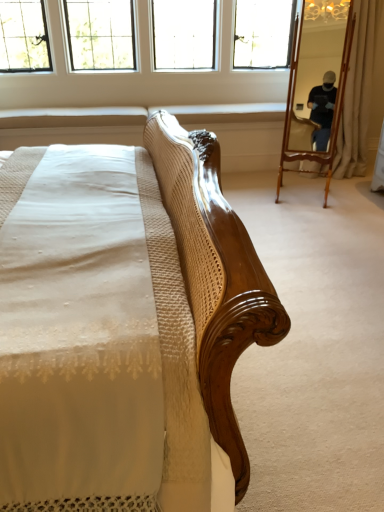
Question: Does clear glass windows at upper center contain beige fabric curtain at right?

Choices:
 (A) no
 (B) yes

Answer: (A)

Question: Considering the relative sizes of clear glass windows at upper center and beige fabric curtain at right in the image provided, is clear glass windows at upper center thinner than beige fabric curtain at right?

Choices:
 (A) yes
 (B) no

Answer: (B)

Question: Is clear glass windows at upper center in front of beige fabric curtain at right?

Choices:
 (A) no
 (B) yes

Answer: (B)

Question: Is clear glass windows at upper center far away from beige fabric curtain at right?

Choices:
 (A) yes
 (B) no

Answer: (A)

Question: Can you confirm if clear glass windows at upper center is positioned to the left of beige fabric curtain at right?

Choices:
 (A) yes
 (B) no

Answer: (A)

Question: Visually, is beige fabric curtain at right positioned to the left or to the right of wooden mirror at right?

Choices:
 (A) left
 (B) right

Answer: (B)

Question: Based on their sizes in the image, would you say beige fabric curtain at right is bigger or smaller than wooden mirror at right?

Choices:
 (A) small
 (B) big

Answer: (A)

Question: Does point (382, 66) appear closer or farther from the camera than point (340, 10)?

Choices:
 (A) closer
 (B) farther

Answer: (B)

Question: In terms of height, does beige fabric curtain at right look taller or shorter compared to wooden mirror at right?

Choices:
 (A) tall
 (B) short

Answer: (A)

Question: Would you say clear glass windows at upper center is inside or outside wooden mirror at right?

Choices:
 (A) inside
 (B) outside

Answer: (B)

Question: Would you say clear glass windows at upper center is to the left or to the right of wooden mirror at right in the picture?

Choices:
 (A) right
 (B) left

Answer: (B)

Question: Considering the positions of point (172, 20) and point (299, 79), is point (172, 20) closer or farther from the camera than point (299, 79)?

Choices:
 (A) closer
 (B) farther

Answer: (B)

Question: From a real-world perspective, is clear glass windows at upper center physically located above or below wooden mirror at right?

Choices:
 (A) below
 (B) above

Answer: (B)

Question: Is clear glass windows at upper center wider or thinner than beige fabric curtain at right?

Choices:
 (A) thin
 (B) wide

Answer: (B)

Question: Considering the relative positions of clear glass windows at upper center and beige fabric curtain at right in the image provided, is clear glass windows at upper center to the left or to the right of beige fabric curtain at right?

Choices:
 (A) left
 (B) right

Answer: (A)